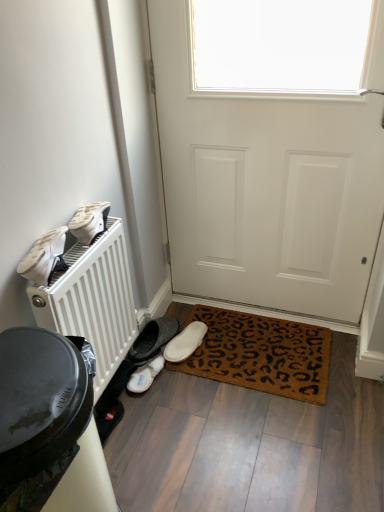
I want to click on blank space situated above brown coir mat at lower center (from a real-world perspective), so click(x=260, y=347).